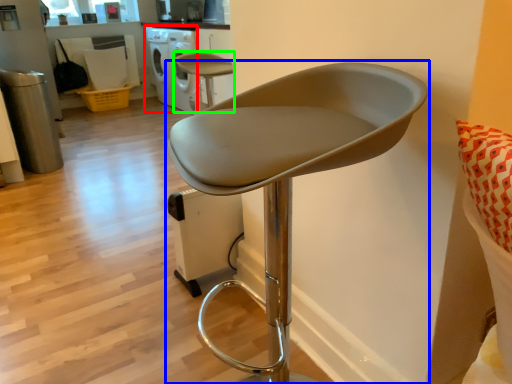
Question: Which object is positioned farthest from dish washer (highlighted by a red box)? Select from chair (highlighted by a blue box) and chair (highlighted by a green box).

Choices:
 (A) chair
 (B) chair

Answer: (A)